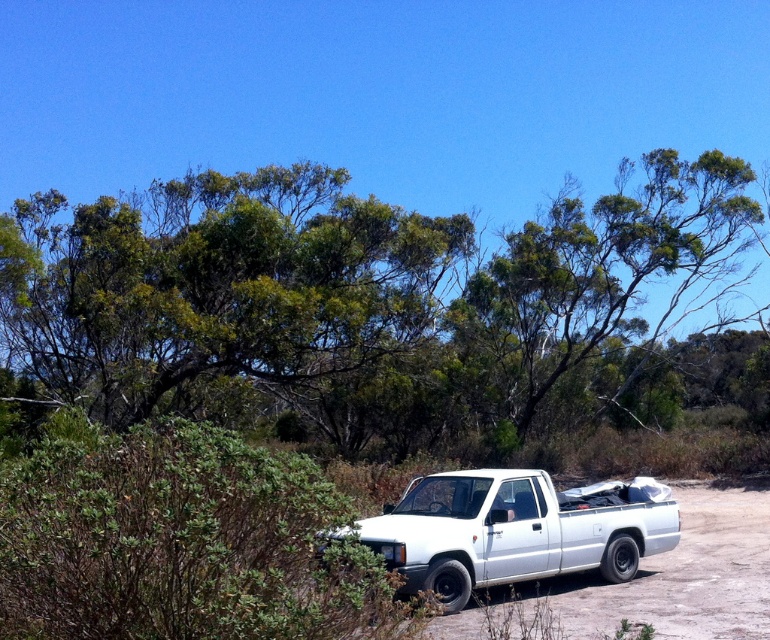
Question: Is the position of green leafy tree at upper center more distant than that of white matte pickup truck at center?

Choices:
 (A) yes
 (B) no

Answer: (A)

Question: Does green leafy tree at upper center have a smaller size compared to white matte pickup truck at center?

Choices:
 (A) no
 (B) yes

Answer: (A)

Question: Does green leafy tree at upper center appear on the right side of white matte pickup truck at center?

Choices:
 (A) yes
 (B) no

Answer: (B)